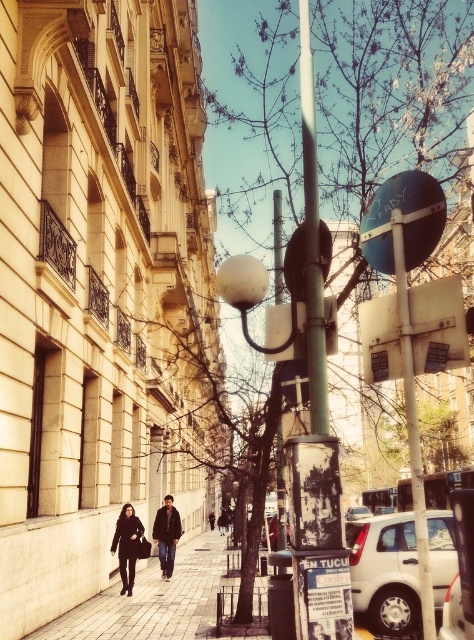
Question: Considering the relative positions of green matte pole at center and black leather coat at lower left in the image provided, where is green matte pole at center located with respect to black leather coat at lower left?

Choices:
 (A) left
 (B) right

Answer: (B)

Question: Which point appears farthest from the camera in this image?

Choices:
 (A) (306, 48)
 (B) (419, 554)
 (C) (143, 532)
 (D) (116, 548)

Answer: (C)

Question: Based on their relative distances, which object is nearer to the black leather coat at lower left?

Choices:
 (A) metallic pole at center
 (B) dark brown leather jacket at lower center

Answer: (B)

Question: Is metallic pole at center further to the viewer compared to black leather coat at lower left?

Choices:
 (A) yes
 (B) no

Answer: (B)

Question: Which of the following is the closest to the observer?

Choices:
 (A) [169, 506]
 (B) [424, 588]
 (C) [309, 179]
 (D) [134, 536]

Answer: (B)

Question: Is green matte pole at center positioned at the back of metallic pole at center?

Choices:
 (A) no
 (B) yes

Answer: (B)